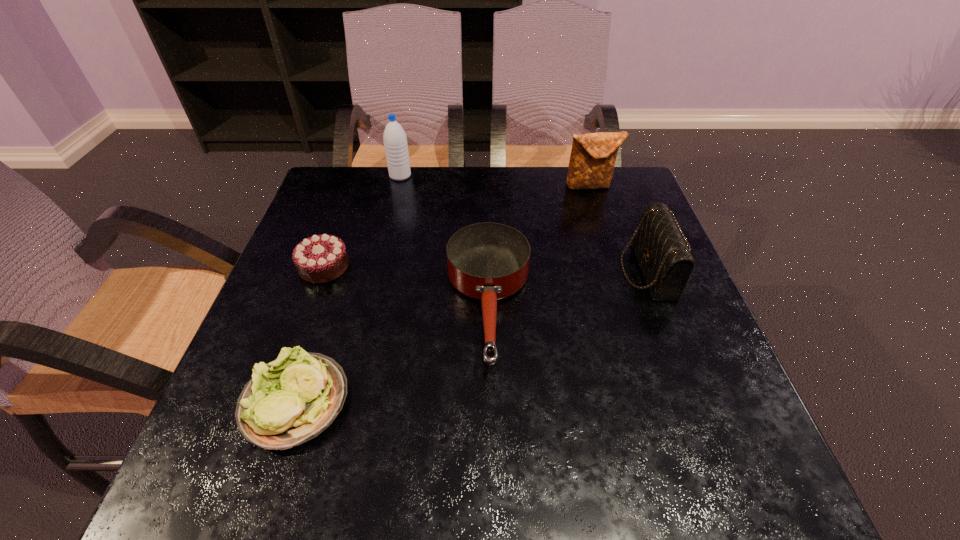
Locate an element on the screen. The width and height of the screenshot is (960, 540). vacant area situated on the front flap of the nearer clutch bag is located at coordinates (462, 271).

The image size is (960, 540). Find the location of `vacant area located 0.290m on the front flap of the nearer clutch bag`. vacant area located 0.290m on the front flap of the nearer clutch bag is located at coordinates (493, 271).

At what (x,y) coordinates should I click in order to perform the action: click on vacant space located on the handle side of the pan. Please return your answer as a coordinate pair (x, y). This screenshot has width=960, height=540. Looking at the image, I should click on (492, 462).

You are a GUI agent. You are given a task and a screenshot of the screen. Output one action in this format:
    pyautogui.click(x=<x>, y=<y>)
    Task: Click on the vacant space situated 0.060m on the right of the chocolate cake
    
    Given the screenshot: What is the action you would take?
    pyautogui.click(x=375, y=267)

Where is `vacant space located 0.140m on the back of the lettuce`? vacant space located 0.140m on the back of the lettuce is located at coordinates (328, 302).

Where is `water bottle that is at the far edge`? water bottle that is at the far edge is located at coordinates (394, 137).

I want to click on clutch bag that is at the far edge, so click(x=593, y=155).

Find the location of a particular element. object present at the near edge is located at coordinates (293, 399).

Find the location of a particular element. This screenshot has width=960, height=540. chocolate cake that is at the left edge is located at coordinates (321, 258).

Where is `lettuce that is at the left edge`? This screenshot has height=540, width=960. lettuce that is at the left edge is located at coordinates (293, 399).